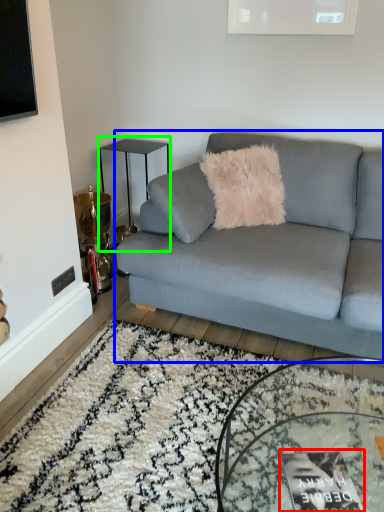
Question: Estimate the real-world distances between objects in this image. Which object is closer to magazine (highlighted by a red box), studio couch (highlighted by a blue box) or table (highlighted by a green box)?

Choices:
 (A) studio couch
 (B) table

Answer: (A)